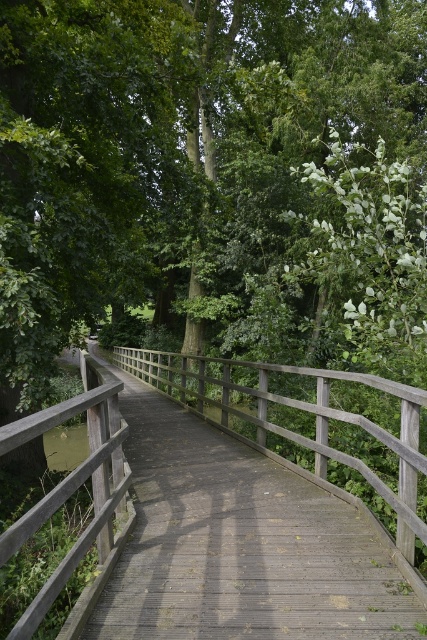
The image size is (427, 640). What do you see at coordinates (242, 545) in the screenshot?
I see `wooden bridge at center` at bounding box center [242, 545].

This screenshot has height=640, width=427. Find the location of `wooden bridge at center`. wooden bridge at center is located at coordinates (242, 545).

The width and height of the screenshot is (427, 640). Identify the location of wooden bridge at center. (242, 545).